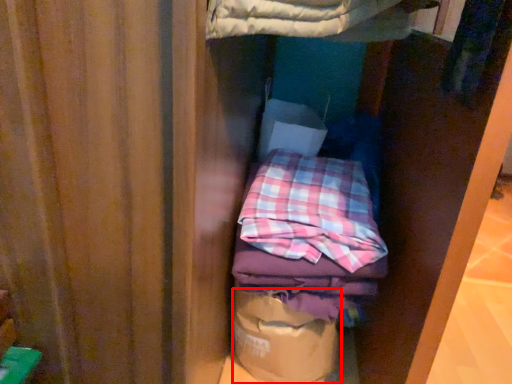
Question: From the image's perspective, what is the correct spatial positioning of paper bag (annotated by the red box) in reference to flannel?

Choices:
 (A) above
 (B) below

Answer: (B)